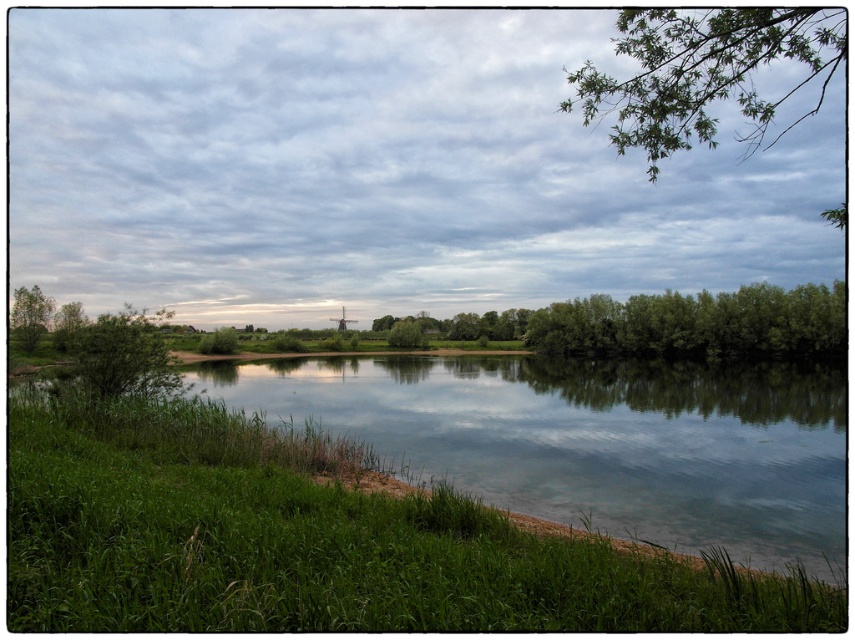
You are standing in the serene landscape and want to take a photo of the green leafy trees at center and the green leafy tree at center. Which tree is located to the right when facing the scene?

The green leafy trees at center is positioned on the right side of green leafy tree at center, so when facing the scene, the green leafy trees at center is to the right of the green leafy tree at center.

You are an artist trying to sketch this landscape. You notice the green leafy branch at upper right and the green leafy tree at center. Which one appears taller in the image?

The green leafy branch at upper right appears taller than the green leafy tree at center.